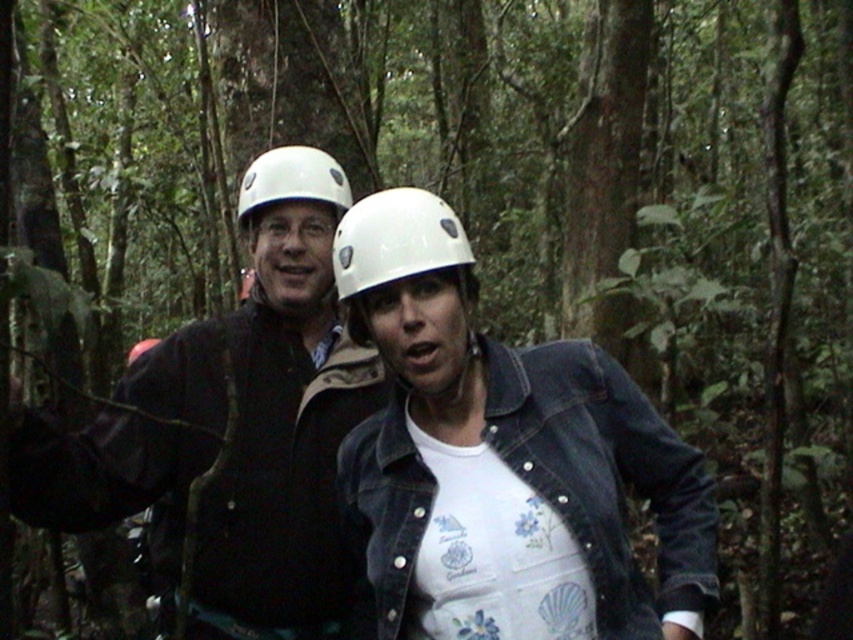
The height and width of the screenshot is (640, 853). What do you see at coordinates (271, 408) in the screenshot? I see `matte black jacket at center` at bounding box center [271, 408].

Can you confirm if matte black jacket at center is thinner than white matte helmet at upper center?

Incorrect, matte black jacket at center's width is not less than white matte helmet at upper center's.

Does point (263, 278) lie behind point (259, 198)?

Yes, it is behind point (259, 198).

Identify the location of matte black jacket at center. (271, 408).

Is point (412, 365) farther from viewer compared to point (175, 426)?

That is False.

Consider the image. Who is more forward, (409, 468) or (294, 424)?

Point (409, 468)

Is point (485, 493) closer to viewer compared to point (281, 538)?

Yes, it is.

The width and height of the screenshot is (853, 640). Find the location of `denim jacket at center`. denim jacket at center is located at coordinates (503, 458).

Identify the location of denim jacket at center. The image size is (853, 640). (503, 458).

Looking at this image, who is more distant from viewer, (457, 524) or (329, 177)?

Positioned behind is point (329, 177).

Where is `denim jacket at center`? Image resolution: width=853 pixels, height=640 pixels. denim jacket at center is located at coordinates (503, 458).